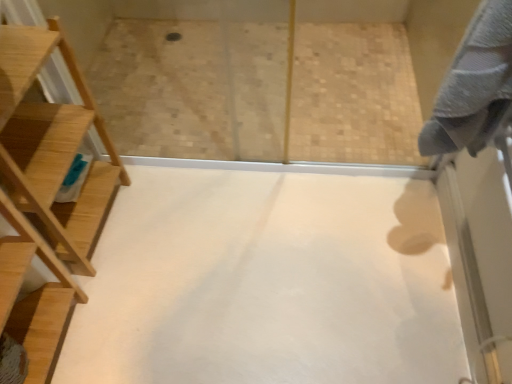
Question: Is gray cotton bath towel at upper right in contact with natural wood ladder at left?

Choices:
 (A) no
 (B) yes

Answer: (A)

Question: From the image's perspective, would you say gray cotton bath towel at upper right is positioned over natural wood ladder at left?

Choices:
 (A) no
 (B) yes

Answer: (B)

Question: Does gray cotton bath towel at upper right turn towards natural wood ladder at left?

Choices:
 (A) yes
 (B) no

Answer: (A)

Question: Does gray cotton bath towel at upper right lie in front of natural wood ladder at left?

Choices:
 (A) no
 (B) yes

Answer: (B)

Question: Is gray cotton bath towel at upper right not close to natural wood ladder at left?

Choices:
 (A) no
 (B) yes

Answer: (A)

Question: Can you confirm if gray cotton bath towel at upper right is bigger than natural wood ladder at left?

Choices:
 (A) yes
 (B) no

Answer: (B)

Question: Is white matte floor at center surrounding natural wood ladder at left?

Choices:
 (A) yes
 (B) no

Answer: (B)

Question: Considering the relative sizes of white matte floor at center and natural wood ladder at left in the image provided, is white matte floor at center smaller than natural wood ladder at left?

Choices:
 (A) no
 (B) yes

Answer: (B)

Question: Is white matte floor at center behind natural wood ladder at left?

Choices:
 (A) no
 (B) yes

Answer: (B)

Question: Is white matte floor at center shorter than natural wood ladder at left?

Choices:
 (A) yes
 (B) no

Answer: (A)

Question: From a real-world perspective, is white matte floor at center under natural wood ladder at left?

Choices:
 (A) no
 (B) yes

Answer: (B)

Question: Would you say white matte floor at center is outside natural wood ladder at left?

Choices:
 (A) no
 (B) yes

Answer: (B)

Question: Is natural wood ladder at left bigger than gray cotton bath towel at upper right?

Choices:
 (A) yes
 (B) no

Answer: (A)